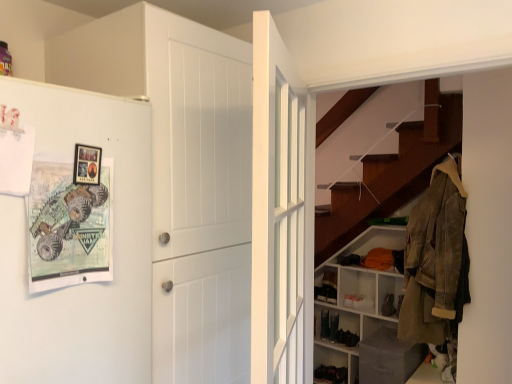
This screenshot has width=512, height=384. Identify the location of black suede shoe at lower center, which ranks as the second shoe in left-to-right order. (333, 326).

This screenshot has width=512, height=384. What do you see at coordinates (184, 176) in the screenshot?
I see `white matte door at center, which is the 1th door from left to right` at bounding box center [184, 176].

This screenshot has height=384, width=512. I want to click on gray fabric box at lower right, the first shelf when ordered from front to back, so click(x=388, y=357).

Identify the location of leather jacket at right. (435, 258).

Is leather jacket at right positioned far away from matte black shoe at lower center, which ranks as the third shoe in front-to-back order?

Absolutely, leather jacket at right is distant from matte black shoe at lower center, which ranks as the third shoe in front-to-back order.

Considering the sizes of objects leather jacket at right and matte black shoe at lower center, which ranks as the third shoe in front-to-back order, in the image provided, who is taller, leather jacket at right or matte black shoe at lower center, which ranks as the third shoe in front-to-back order,?

With more height is leather jacket at right.

Considering the relative positions of leather jacket at right and matte black shoe at lower center, which is the first shoe in back-to-front order, in the image provided, is leather jacket at right to the right of matte black shoe at lower center, which is the first shoe in back-to-front order, from the viewer's perspective?

Yes, leather jacket at right is to the right of matte black shoe at lower center, which is the first shoe in back-to-front order.

From the image's perspective, is leather jacket at right below matte black shoe at lower center, which ranks as the third shoe in front-to-back order?

No, from the image's perspective, leather jacket at right is not beneath matte black shoe at lower center, which ranks as the third shoe in front-to-back order.

Does point (267, 291) come in front of point (142, 351)?

That is True.

Considering the sizes of white wooden door at center, arranged as the 1th door when viewed from the right, and white matte refrigerator at left in the image, is white wooden door at center, arranged as the 1th door when viewed from the right, bigger or smaller than white matte refrigerator at left?

Clearly, white wooden door at center, arranged as the 1th door when viewed from the right, is smaller in size than white matte refrigerator at left.

From the picture: Can you confirm if white wooden door at center, the 2th door when ordered from left to right, is thinner than white matte refrigerator at left?

Yes.

Locate an element on the screen. The width and height of the screenshot is (512, 384). the 2nd door to the right of the white matte refrigerator at left, counting from the anchor's position is located at coordinates (281, 213).

Considering the sizes of objects white matte shelving unit at lower right, positioned as the second shelf in front-to-back order, and matte black shoe at lower center, which ranks as the third shoe in front-to-back order, in the image provided, who is smaller, white matte shelving unit at lower right, positioned as the second shelf in front-to-back order, or matte black shoe at lower center, which ranks as the third shoe in front-to-back order,?

Smaller between the two is matte black shoe at lower center, which ranks as the third shoe in front-to-back order.

Could matte black shoe at lower center, which is the first shoe from left to right, be considered to be inside white matte shelving unit at lower right, positioned as the second shelf in front-to-back order?

Yes, matte black shoe at lower center, which is the first shoe from left to right, is inside white matte shelving unit at lower right, positioned as the second shelf in front-to-back order.

Does point (345, 360) come behind point (321, 321)?

No, it is in front of (321, 321).

Is matte black shoe at lower center, which is the first shoe from left to right, in contact with white matte refrigerator at left?

They are not placed beside each other.

Considering the relative sizes of matte black shoe at lower center, which is the first shoe from left to right, and white matte refrigerator at left in the image provided, is matte black shoe at lower center, which is the first shoe from left to right, wider than white matte refrigerator at left?

Incorrect, the width of matte black shoe at lower center, which is the first shoe from left to right, does not surpass that of white matte refrigerator at left.

What's the angular difference between matte black shoe at lower center, the third shoe viewed from the right, and white matte refrigerator at left's facing directions?

90 degrees.

Does matte black shoe at lower center, the third shoe viewed from the right, have a greater height compared to white matte refrigerator at left?

Incorrect, the height of matte black shoe at lower center, the third shoe viewed from the right, is not larger of that of white matte refrigerator at left.

Is white matte refrigerator at left taller or shorter than white matte shelving unit at lower right, the first shelf from the back?

In the image, white matte refrigerator at left appears to be shorter than white matte shelving unit at lower right, the first shelf from the back.

From a real-world perspective, which is physically below, white matte refrigerator at left or white matte shelving unit at lower right, positioned as the second shelf in front-to-back order?

In real-world perspective, white matte shelving unit at lower right, positioned as the second shelf in front-to-back order, is lower.

Is white matte refrigerator at left positioned before white matte shelving unit at lower right, the first shelf from the back?

Yes, it is.

Is white matte refrigerator at left to the right of white matte shelving unit at lower right, positioned as the second shelf in front-to-back order, from the viewer's perspective?

A: Incorrect, white matte refrigerator at left is not on the right side of white matte shelving unit at lower right, positioned as the second shelf in front-to-back order.

The height and width of the screenshot is (384, 512). Find the location of `clothing directly beneath the white matte refrigerator at left (from a real-world perspective)`. clothing directly beneath the white matte refrigerator at left (from a real-world perspective) is located at coordinates (435, 258).

Considering the relative sizes of leather jacket at right and white matte refrigerator at left in the image provided, is leather jacket at right wider than white matte refrigerator at left?

No, leather jacket at right is not wider than white matte refrigerator at left.

Looking at this image, is leather jacket at right in front of white matte refrigerator at left?

That is False.

Is gray fabric box at lower right, the first shelf when ordered from front to back, bigger than black suede shoe at lower center, arranged as the 2th shoe when viewed from the back?

Correct, gray fabric box at lower right, the first shelf when ordered from front to back, is larger in size than black suede shoe at lower center, arranged as the 2th shoe when viewed from the back.

Would you say gray fabric box at lower right, the first shelf when ordered from front to back, contains black suede shoe at lower center, the second shoe when ordered from right to left?

No, black suede shoe at lower center, the second shoe when ordered from right to left, is not a part of gray fabric box at lower right, the first shelf when ordered from front to back.

Considering the positions of objects gray fabric box at lower right, the first shelf when ordered from front to back, and black suede shoe at lower center, positioned as the second shoe in front-to-back order, in the image provided, who is more to the left, gray fabric box at lower right, the first shelf when ordered from front to back, or black suede shoe at lower center, positioned as the second shoe in front-to-back order,?

black suede shoe at lower center, positioned as the second shoe in front-to-back order, is more to the left.

Is gray fabric box at lower right, the second shelf in the back-to-front sequence, positioned with its back to black suede shoe at lower center, which ranks as the second shoe in left-to-right order?

No.

The width and height of the screenshot is (512, 384). I want to click on clothing that is on the right side of matte black shoe at lower center, which ranks as the third shoe in front-to-back order, so click(x=435, y=258).

Where is `fridge below the white wooden door at center, arranged as the 1th door when viewed from the right (from the image's perspective)`? fridge below the white wooden door at center, arranged as the 1th door when viewed from the right (from the image's perspective) is located at coordinates (113, 249).

Based on their spatial positions, is white matte shelving unit at lower right, the first shelf from the back, or white matte refrigerator at left further from black suede shoe at lower center, positioned as the second shoe in front-to-back order?

white matte refrigerator at left is positioned further to the anchor black suede shoe at lower center, positioned as the second shoe in front-to-back order.

Considering their positions, is white matte door at center, placed as the second door when sorted from right to left, positioned further to black suede shoe at lower center, which ranks as the second shoe in left-to-right order, than white matte refrigerator at left?

Among the two, white matte refrigerator at left is located further to black suede shoe at lower center, which ranks as the second shoe in left-to-right order.

Considering their positions, is black suede shoe at lower center, which ranks as the second shoe in left-to-right order, positioned further to matte black shoe at lower center, which ranks as the third shoe in front-to-back order, than black suede shoe at lower center, the 1th shoe viewed from the right?

The object further to matte black shoe at lower center, which ranks as the third shoe in front-to-back order, is black suede shoe at lower center, the 1th shoe viewed from the right.

Based on their spatial positions, is white matte shelving unit at lower right, the first shelf from the back, or leather jacket at right closer to matte black shoe at lower center, which is the first shoe from left to right?

Based on the image, white matte shelving unit at lower right, the first shelf from the back, appears to be nearer to matte black shoe at lower center, which is the first shoe from left to right.

Looking at the image, which one is located further to white matte refrigerator at left, leather jacket at right or black suede shoe at lower center, which ranks as the second shoe in left-to-right order?

black suede shoe at lower center, which ranks as the second shoe in left-to-right order, lies further to white matte refrigerator at left than the other object.

Based on the photo, when comparing their distances from white wooden door at center, the 2th door when ordered from left to right, does white matte door at center, which is the 1th door from left to right, or black suede shoe at lower center, the third shoe viewed from the back, seem further?

black suede shoe at lower center, the third shoe viewed from the back, is positioned further to the anchor white wooden door at center, the 2th door when ordered from left to right.

Based on their spatial positions, is white wooden door at center, arranged as the 1th door when viewed from the right, or black suede shoe at lower center, the second shoe when ordered from right to left, closer to white matte refrigerator at left?

white wooden door at center, arranged as the 1th door when viewed from the right, is closer to white matte refrigerator at left.

Estimate the real-world distances between objects in this image. Which object is closer to leather jacket at right, white matte shelving unit at lower right, positioned as the second shelf in front-to-back order, or black suede shoe at lower center, the 1th shoe viewed from the right?

white matte shelving unit at lower right, positioned as the second shelf in front-to-back order, lies closer to leather jacket at right than the other object.

Find the location of a particular element. shelf positioned between gray fabric box at lower right, the first shelf when ordered from front to back, and black suede shoe at lower center, the third shoe viewed from the back, from near to far is located at coordinates (357, 294).

Identify the location of shoe located between matte black shoe at lower center, which ranks as the third shoe in front-to-back order, and black suede shoe at lower center, the 1th shoe viewed from the right, in the left-right direction. This screenshot has height=384, width=512. (333, 326).

Locate an element on the screen. This screenshot has width=512, height=384. clothing between white matte door at center, which is the 1th door from left to right, and black suede shoe at lower center, the third shoe viewed from the back, in the front-back direction is located at coordinates (435, 258).

Locate an element on the screen. This screenshot has width=512, height=384. shoe located between white matte refrigerator at left and black suede shoe at lower center, which ranks as the second shoe in left-to-right order, in the depth direction is located at coordinates (388, 305).